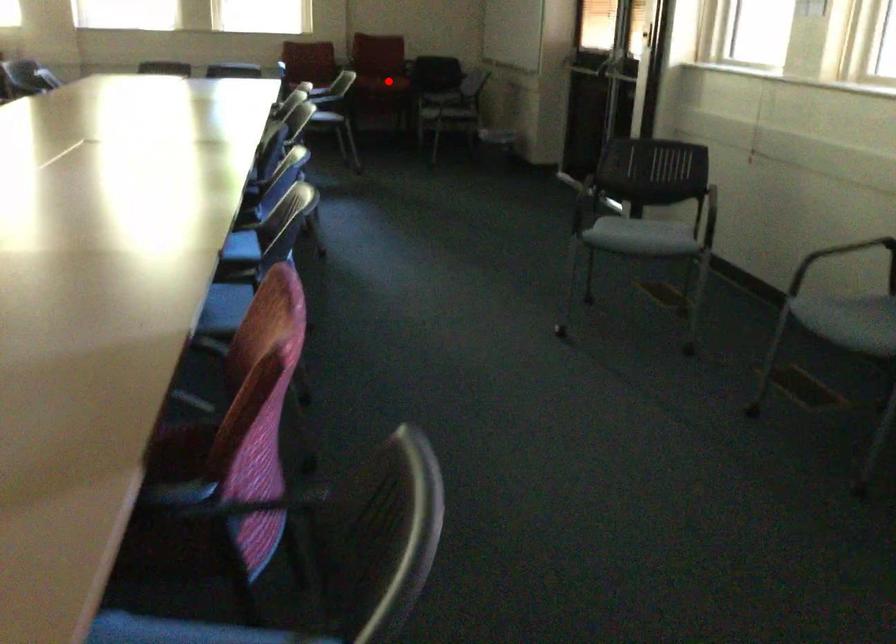
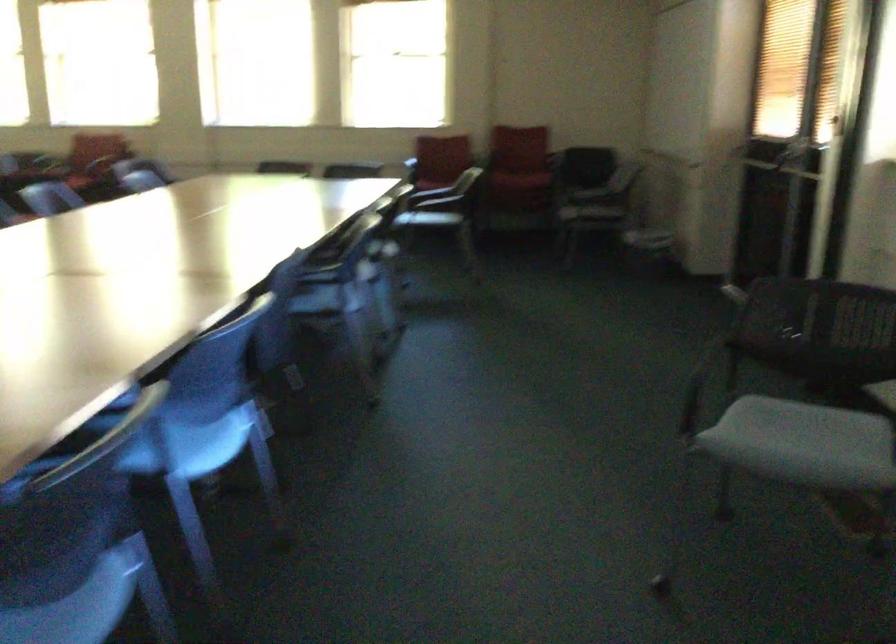
Question: I am providing you with two images of the same scene from different viewpoints. In image1, a red point is highlighted. Considering the same 3D point in image2, which of the following is correct?

Choices:
 (A) It is closer
 (B) It is farther

Answer: (A)